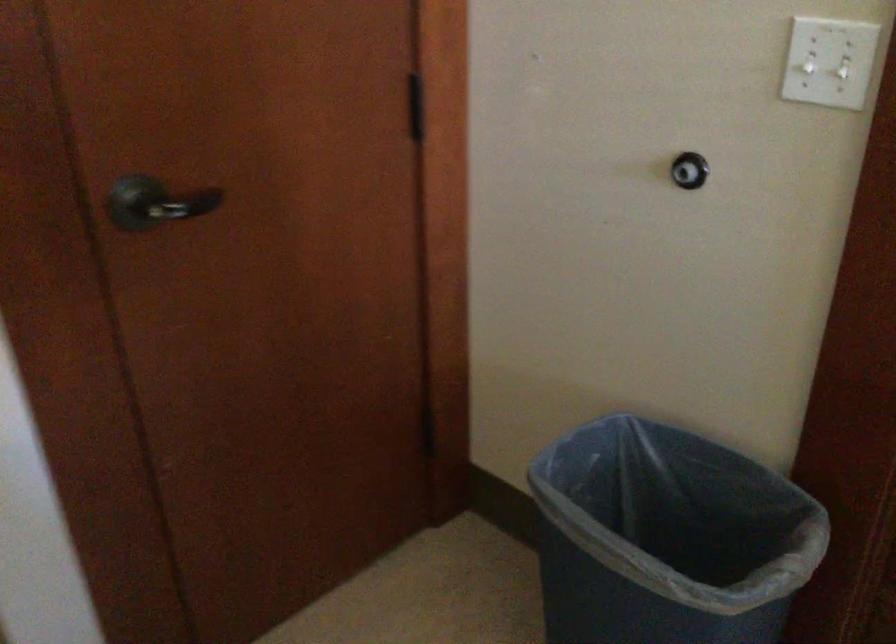
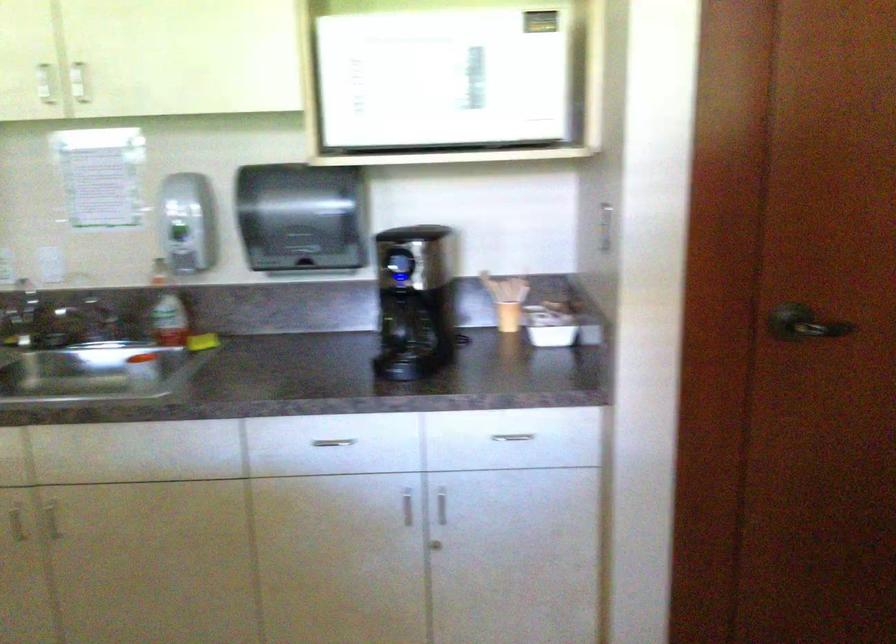
In the second image, find the point that corresponds to point 177,210 in the first image.

(803, 323)